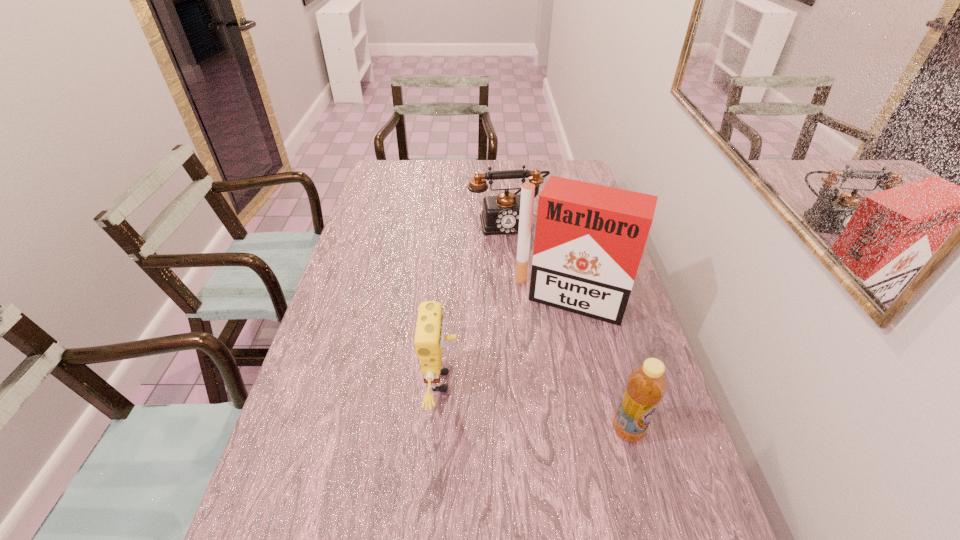
Find the location of a particular element. free space on the desktop that is between the leftmost object and the bottle and is positioned on the front of the telephone at the rotary dial is located at coordinates (559, 412).

Identify the location of free space on the desktop that is between the leftmost object and the bottle and is positioned on the front-facing side of the cigarette case. (532, 405).